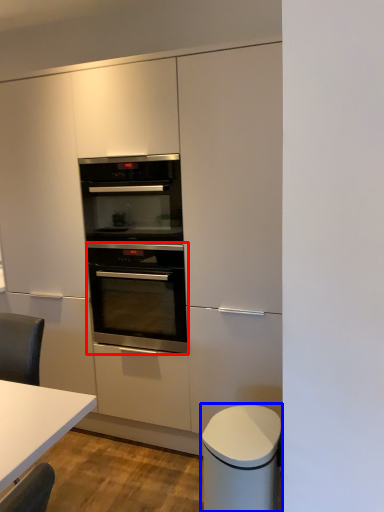
Question: Which object appears closest to the camera in this image, oven (highlighted by a red box) or cabinetry (highlighted by a blue box)?

Choices:
 (A) oven
 (B) cabinetry

Answer: (B)